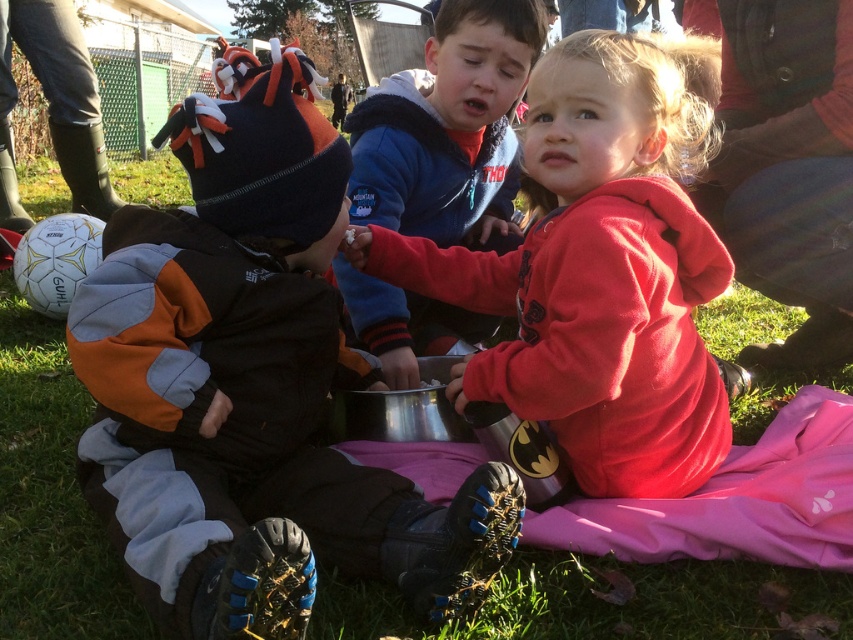
Question: Is red fleece jacket at center below blue fleece jacket at center?

Choices:
 (A) no
 (B) yes

Answer: (B)

Question: Is orange fleece jacket at center closer to camera compared to blue fleece jacket at center?

Choices:
 (A) yes
 (B) no

Answer: (A)

Question: Which object appears closest to the camera in this image?

Choices:
 (A) blue fleece jacket at center
 (B) red fleece jacket at center
 (C) orange fleece jacket at center

Answer: (C)

Question: Which of these objects is positioned farthest from the red fleece jacket at center?

Choices:
 (A) blue fleece jacket at center
 (B) orange fleece jacket at center

Answer: (A)

Question: Does orange fleece jacket at center lie in front of red fleece jacket at center?

Choices:
 (A) no
 (B) yes

Answer: (B)

Question: Which point is farther to the camera?

Choices:
 (A) (654, 454)
 (B) (280, 243)
 (C) (405, 116)

Answer: (C)